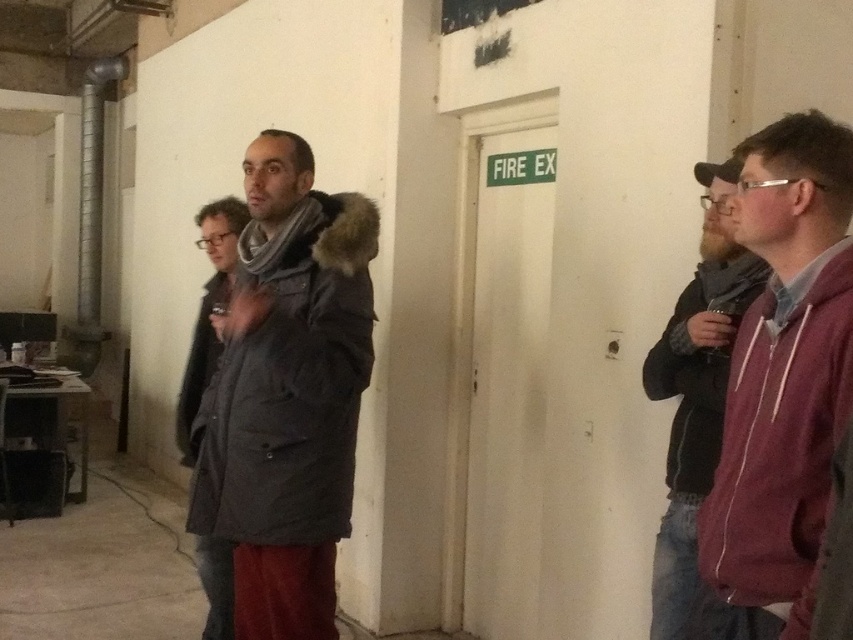
Question: Which point appears closest to the camera in this image?

Choices:
 (A) (213, 243)
 (B) (814, 426)
 (C) (704, 314)

Answer: (B)

Question: Where is maroon zip-up hoodie at right located in relation to maroon fleece jacket at right in the image?

Choices:
 (A) above
 (B) below

Answer: (A)

Question: Can you confirm if dark gray fur-lined coat at center is positioned to the right of maroon fleece jacket at right?

Choices:
 (A) yes
 (B) no

Answer: (B)

Question: Which object is closer to the camera taking this photo?

Choices:
 (A) maroon fleece jacket at right
 (B) maroon zip-up hoodie at right

Answer: (B)

Question: Based on their relative distances, which object is farther from the maroon zip-up hoodie at right?

Choices:
 (A) dark gray fur-lined coat at center
 (B) dark gray wool coat at center
 (C) maroon fleece jacket at right

Answer: (B)

Question: From the image, what is the correct spatial relationship of dark gray fur-lined coat at center in relation to maroon zip-up hoodie at right?

Choices:
 (A) left
 (B) right

Answer: (A)